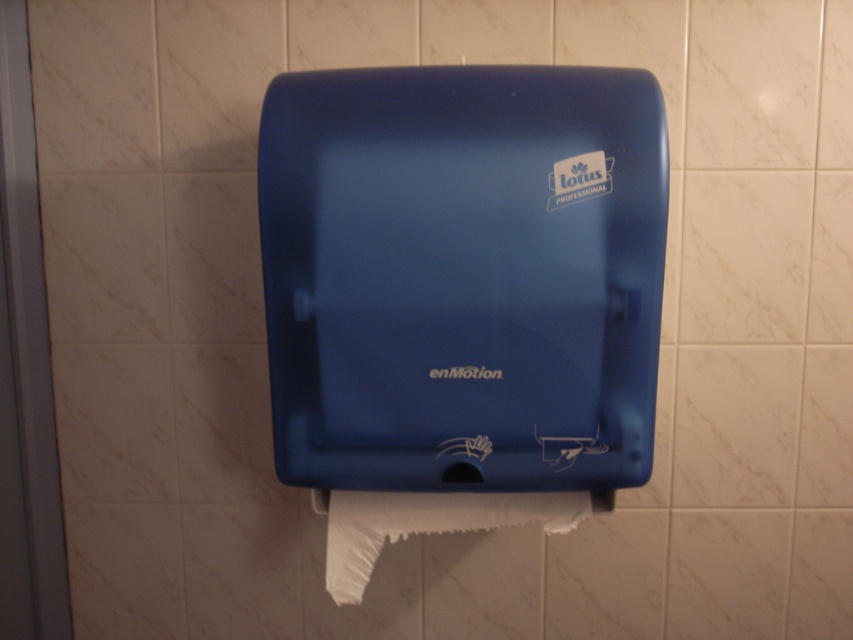
You are a maintenance worker who needs to replace the paper products. The dispenser you are holding is 1.2 meters tall. Can you determine if the matte blue dispenser at center will fit into the existing space above the white matte toilet paper at lower center?

The matte blue dispenser at center is much taller than the white matte toilet paper at lower center. Since your dispenser is 1.2 meters tall, it may not fit into the existing space if the current dispenser is taller and the space is limited.

Looking at this image, you are standing in front of the blue paper towel dispenser. You want to reach the point at coordinates point (639, 257). If your hand can extend 30 inches, can you reach it?

The point (639, 257) is 32.92 inches away from you, which is beyond your hand extension of 30 inches. You cannot reach it.

You are a maintenance worker who needs to replace the batteries in a device. You have a tool that requires at least 8 inches of space to operate. Are the matte blue dispenser at center and white matte toilet paper at lower center positioned far enough apart for you to work comfortably?

The distance between the matte blue dispenser at center and the white matte toilet paper at lower center is 7.02 inches, which is less than the required 8 inches. Therefore, there isn not enough space for the tool to operate comfortably.